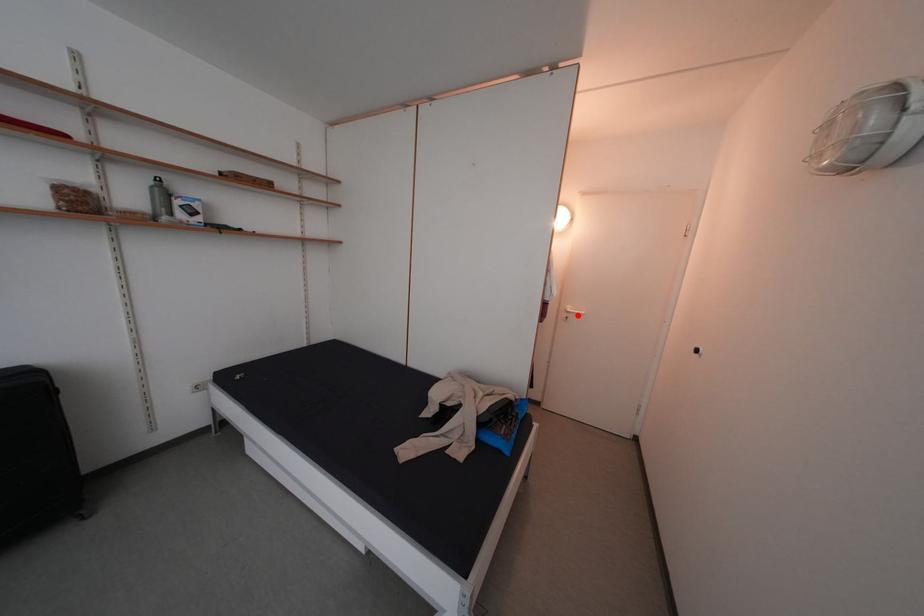
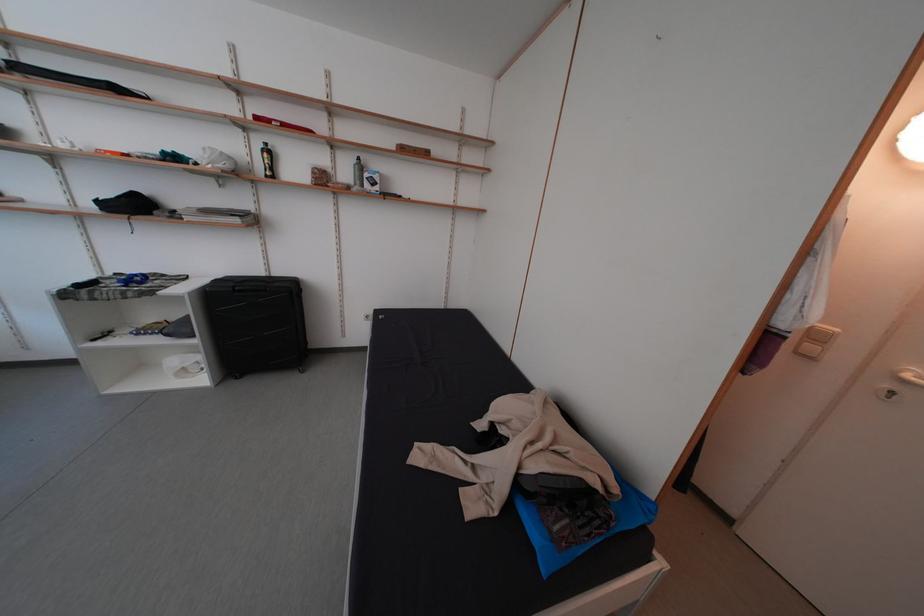
Where in the second image is the point corresponding to the highlighted location from the first image?

(917, 381)